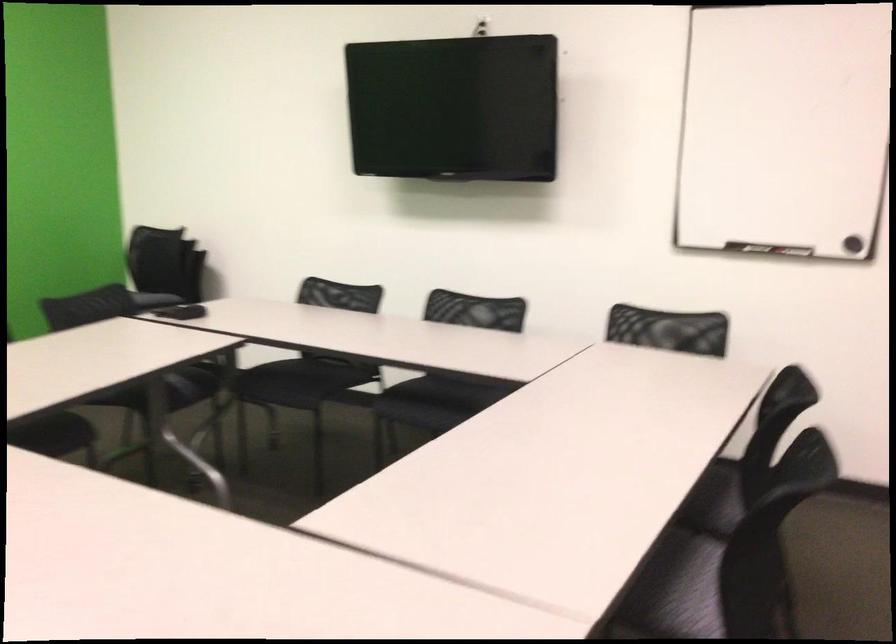
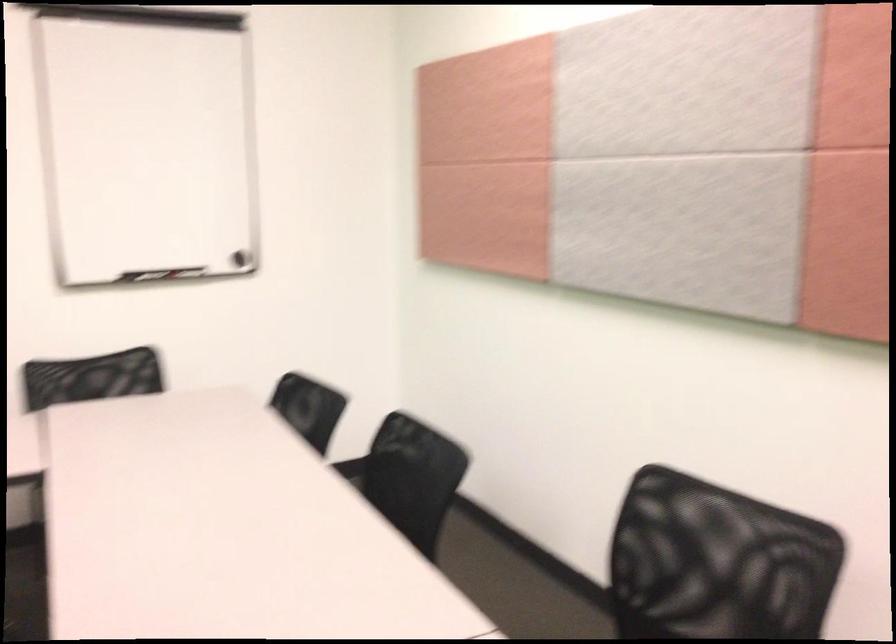
The point at (677, 325) is marked in the first image. Where is the corresponding point in the second image?

(91, 377)